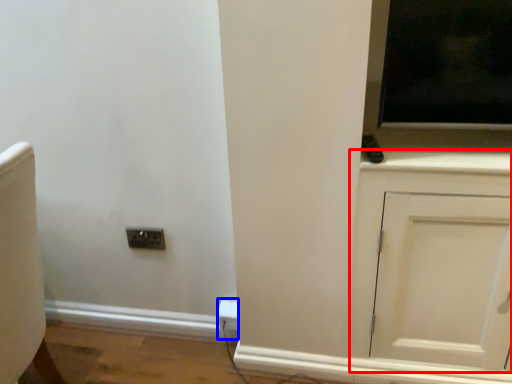
Question: Which point is further to the camera, cabinetry (highlighted by a red box) or electric outlet (highlighted by a blue box)?

Choices:
 (A) cabinetry
 (B) electric outlet

Answer: (B)